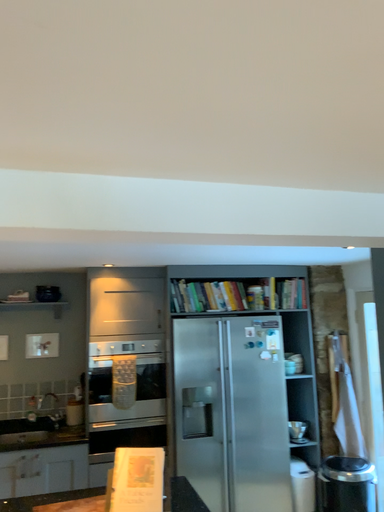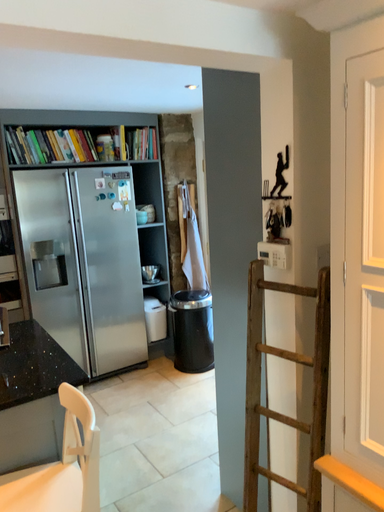
Question: How did the camera likely rotate when shooting the video?

Choices:
 (A) rotated right
 (B) rotated left

Answer: (A)